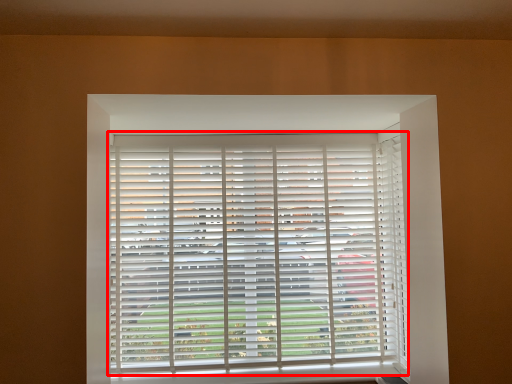
Question: From the image, what is the correct spatial relationship of window blind (annotated by the red box) in relation to curtain?

Choices:
 (A) left
 (B) right

Answer: (A)